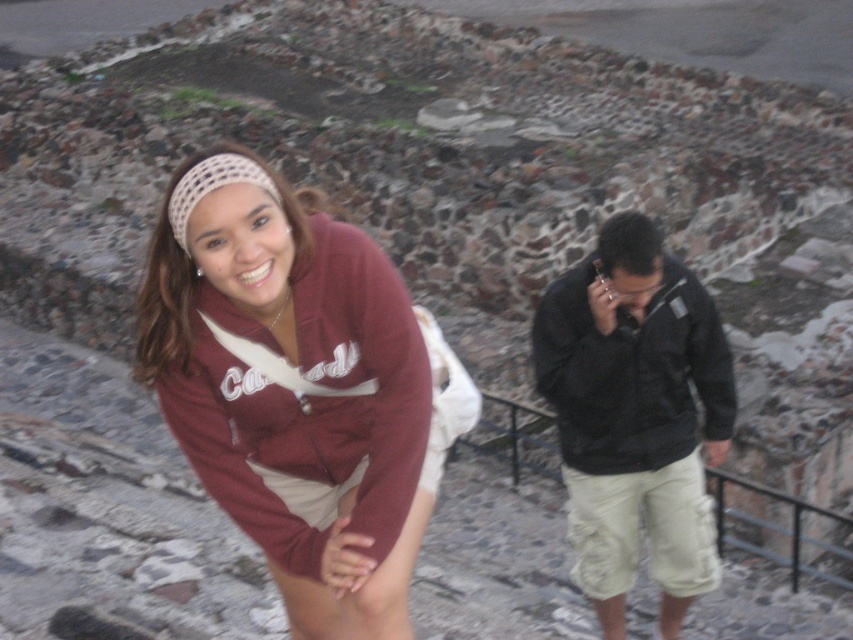
From the picture: Can you confirm if matte maroon hoodie at center is positioned above black matte jacket at right?

Yes.

Measure the distance from matte maroon hoodie at center to black matte jacket at right.

7.96 feet

At what (x,y) coordinates should I click in order to perform the action: click on matte maroon hoodie at center. Please return your answer as a coordinate pair (x, y). The image size is (853, 640). Looking at the image, I should click on (300, 388).